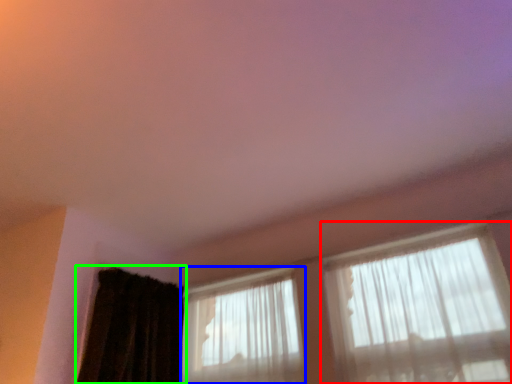
Question: Which object is the closest to the window (highlighted by a red box)? Choose among these: window (highlighted by a blue box) or curtain (highlighted by a green box).

Choices:
 (A) window
 (B) curtain

Answer: (A)